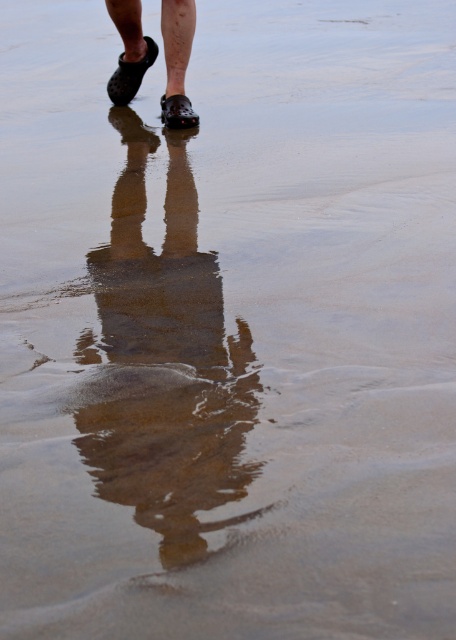
Question: Which of the following is the closest to the observer?

Choices:
 (A) (114, 72)
 (B) (167, 13)

Answer: (B)

Question: Is black rubber sandal at upper center wider than matte black shoe at center?

Choices:
 (A) no
 (B) yes

Answer: (B)

Question: Observing the image, what is the correct spatial positioning of black rubber shoes at upper center in reference to black rubber sandal at upper center?

Choices:
 (A) right
 (B) left

Answer: (A)

Question: Is black rubber shoes at upper center above matte black shoe at center?

Choices:
 (A) no
 (B) yes

Answer: (B)

Question: Estimate the real-world distances between objects in this image. Which object is closer to the matte black shoe at center?

Choices:
 (A) black rubber shoes at upper center
 (B) black rubber sandal at upper center

Answer: (A)

Question: Among these objects, which one is farthest from the camera?

Choices:
 (A) black rubber sandal at upper center
 (B) matte black shoe at center

Answer: (A)